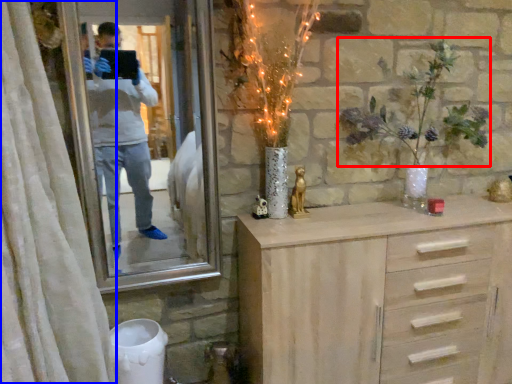
Question: Which object is further to the camera taking this photo, floral arrangement (highlighted by a red box) or curtain (highlighted by a blue box)?

Choices:
 (A) floral arrangement
 (B) curtain

Answer: (A)